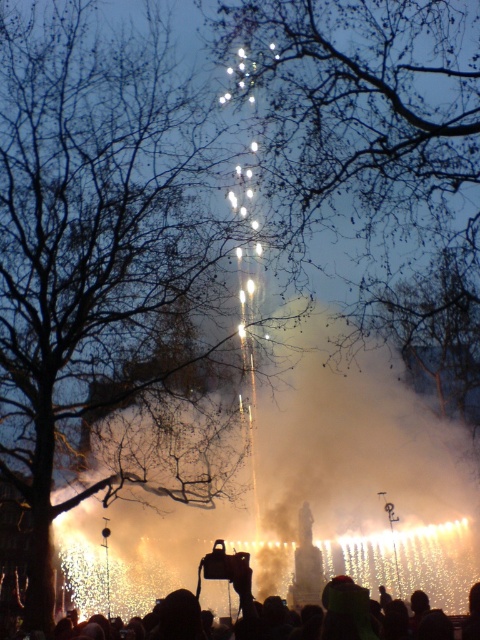
Question: Which of the following is the farthest from the observer?

Choices:
 (A) (444, 634)
 (B) (46, 480)

Answer: (B)

Question: Which of the following is the farthest from the observer?

Choices:
 (A) (51, 112)
 (B) (434, 611)

Answer: (A)

Question: Does bare branches at center have a smaller size compared to silhouette crowd at lower center?

Choices:
 (A) yes
 (B) no

Answer: (B)

Question: Does bare branches at center have a lesser width compared to silhouette crowd at lower center?

Choices:
 (A) yes
 (B) no

Answer: (A)

Question: Considering the relative positions of bare branches at center and silhouette crowd at lower center in the image provided, where is bare branches at center located with respect to silhouette crowd at lower center?

Choices:
 (A) left
 (B) right

Answer: (A)